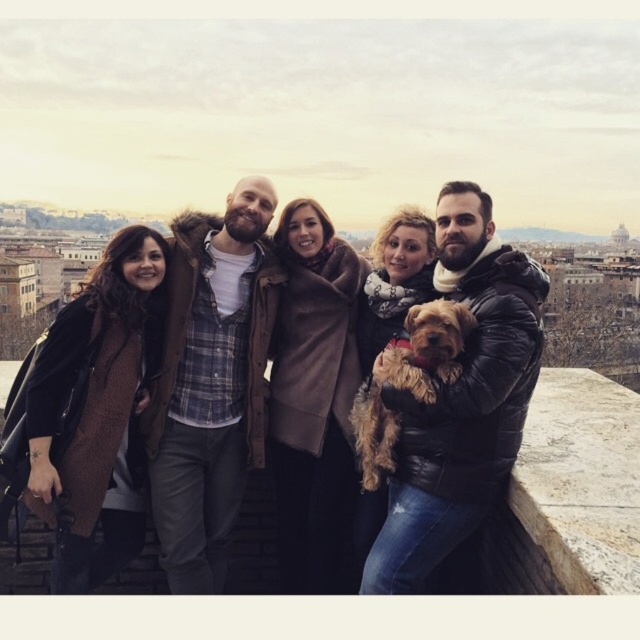
Question: Can you confirm if brown woolen scarf at upper center is thinner than fuzzy brown dog at center?

Choices:
 (A) no
 (B) yes

Answer: (A)

Question: Is black leather jacket at center smaller than brown woolen scarf at upper center?

Choices:
 (A) yes
 (B) no

Answer: (A)

Question: Among these points, which one is farthest from the camera?

Choices:
 (A) (364, 413)
 (B) (506, 392)
 (C) (458, 221)

Answer: (C)

Question: Can you confirm if brown woolen scarf at upper center is smaller than fuzzy brown dog at center?

Choices:
 (A) no
 (B) yes

Answer: (A)

Question: Among these points, which one is farthest from the camera?

Choices:
 (A) (477, 525)
 (B) (442, 349)
 (C) (525, 308)

Answer: (B)

Question: Among these points, which one is farthest from the camera?

Choices:
 (A) (380, 401)
 (B) (488, 428)

Answer: (A)